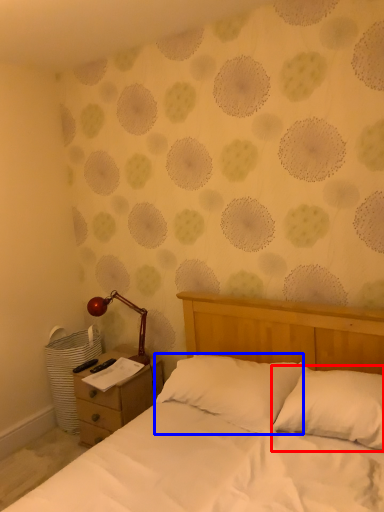
Question: Which object is closer to the camera taking this photo, pillow (highlighted by a red box) or pillow (highlighted by a blue box)?

Choices:
 (A) pillow
 (B) pillow

Answer: (A)